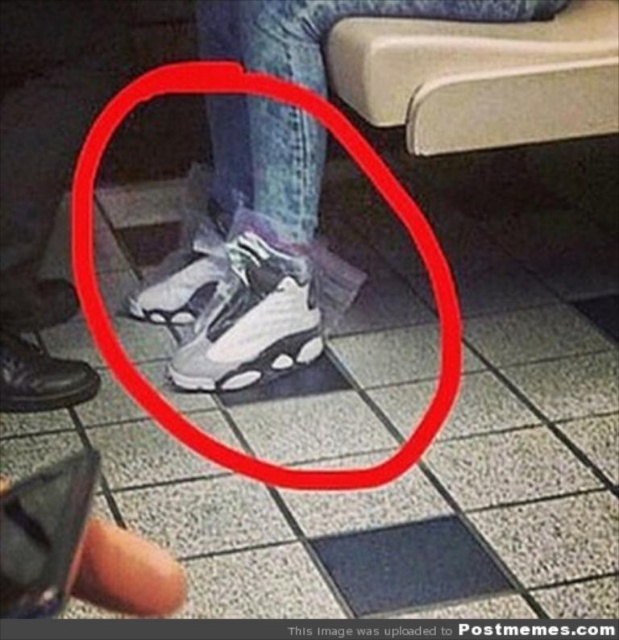
Question: Can you confirm if white matte sneakers at center is positioned above matte white sneaker at center?

Choices:
 (A) no
 (B) yes

Answer: (B)

Question: Which point is farther to the camera?

Choices:
 (A) (331, 468)
 (B) (178, 358)
 (C) (90, 378)
 (D) (79, 524)

Answer: (B)

Question: Observing the image, what is the correct spatial positioning of white matte sneaker at center in reference to matte white sneaker at center?

Choices:
 (A) above
 (B) below

Answer: (A)

Question: Is the position of black matte smartphone at lower left more distant than that of white matte sneaker at center?

Choices:
 (A) yes
 (B) no

Answer: (B)

Question: Which of the following is the closest to the observer?

Choices:
 (A) black matte smartphone at lower left
 (B) black leather shoe at lower left
 (C) white matte sneakers at center

Answer: (C)

Question: Which object is the closest to the white leather sneaker at center?

Choices:
 (A) white matte sneaker at center
 (B) matte white sneaker at center
 (C) black matte smartphone at lower left
 (D) black leather shoe at lower left

Answer: (A)